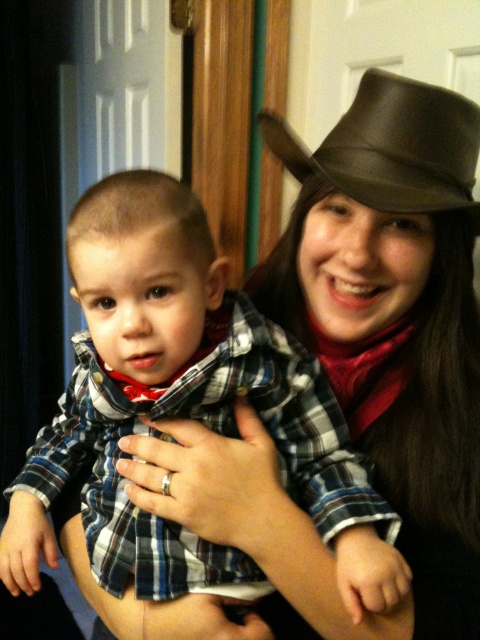
You are trying to locate the plaid fabric shirt at center in the image. The coordinates given are point A at (182, 406). Can you confirm if point A is the correct location for the plaid fabric shirt at center?

Yes, point A at (182, 406) marks the plaid fabric shirt at center as stated in the description.

You are a photographer setting up for a family portrait. You notice the plaid fabric shirt at center and the brown leather fedora at upper right. Which object is positioned closer to the left side of the frame?

The plaid fabric shirt at center is positioned closer to the left side of the frame than the brown leather fedora at upper right.